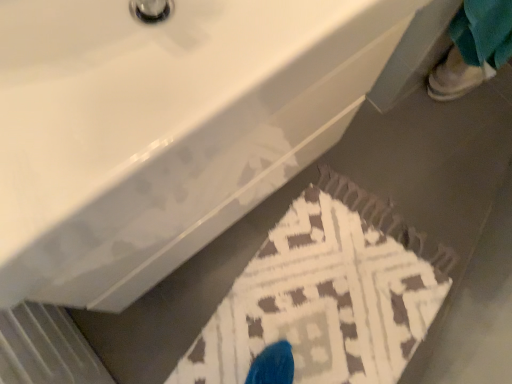
Identify the location of free space to the back side of brown textured rug at lower center. The width and height of the screenshot is (512, 384). (416, 156).